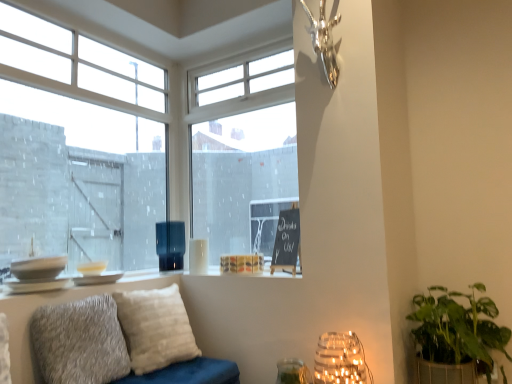
Question: Is clear glass vase at lower center in contact with matte black vase at center, which is counted as the first lamp, starting from the left?

Choices:
 (A) no
 (B) yes

Answer: (A)

Question: Does clear glass vase at lower center have a smaller size compared to matte black vase at center, the second lamp viewed from the front?

Choices:
 (A) yes
 (B) no

Answer: (A)

Question: Considering the relative sizes of clear glass vase at lower center and matte black vase at center, which is the second lamp in right-to-left order, in the image provided, is clear glass vase at lower center taller than matte black vase at center, which is the second lamp in right-to-left order,?

Choices:
 (A) no
 (B) yes

Answer: (A)

Question: From the image's perspective, is clear glass vase at lower center over matte black vase at center, the second lamp viewed from the front?

Choices:
 (A) no
 (B) yes

Answer: (A)

Question: Does clear glass vase at lower center have a lesser width compared to matte black vase at center, which is counted as the first lamp, starting from the left?

Choices:
 (A) yes
 (B) no

Answer: (B)

Question: From a real-world perspective, is clear glass vase at lower center over matte black vase at center, the 2th lamp when ordered from bottom to top?

Choices:
 (A) yes
 (B) no

Answer: (B)

Question: Is green leafy plant in woven basket at lower right positioned beyond the bounds of fuzzy gray pillow at lower left, which is the first pillow in front-to-back order?

Choices:
 (A) yes
 (B) no

Answer: (A)

Question: Would you say fuzzy gray pillow at lower left, acting as the 2th pillow starting from the back, is part of green leafy plant in woven basket at lower right's contents?

Choices:
 (A) yes
 (B) no

Answer: (B)

Question: Is green leafy plant in woven basket at lower right thinner than fuzzy gray pillow at lower left, which is the first pillow in front-to-back order?

Choices:
 (A) yes
 (B) no

Answer: (B)

Question: From the image's perspective, is green leafy plant in woven basket at lower right below fuzzy gray pillow at lower left, acting as the 2th pillow starting from the back?

Choices:
 (A) no
 (B) yes

Answer: (B)

Question: Is green leafy plant in woven basket at lower right further to camera compared to fuzzy gray pillow at lower left, which is the first pillow in front-to-back order?

Choices:
 (A) yes
 (B) no

Answer: (B)

Question: Is green leafy plant in woven basket at lower right at the right side of fuzzy gray pillow at lower left, which is the first pillow in front-to-back order?

Choices:
 (A) yes
 (B) no

Answer: (A)

Question: From the image's perspective, would you say transparent glass window at center, which is the second window in left-to-right order, is positioned over green leafy plant in woven basket at lower right?

Choices:
 (A) no
 (B) yes

Answer: (B)